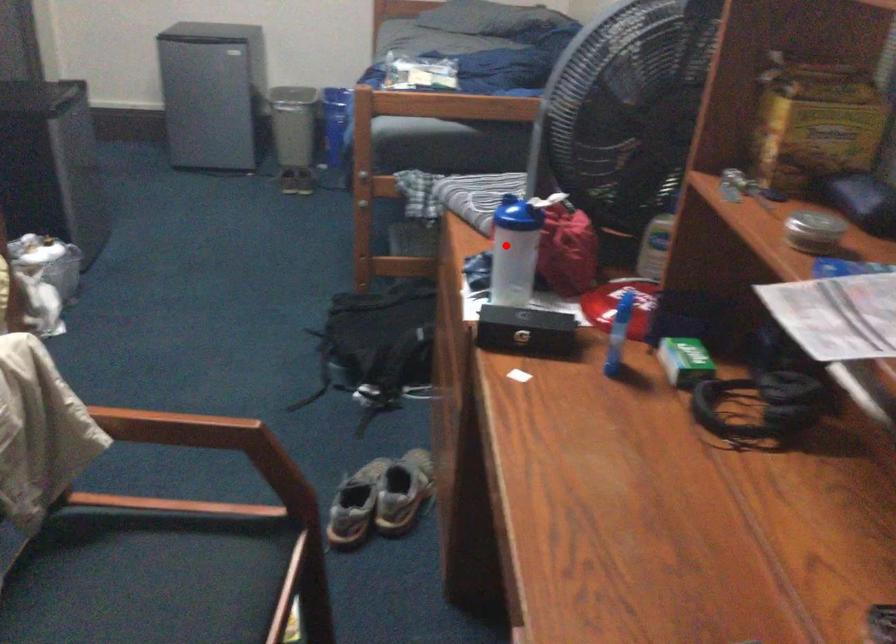
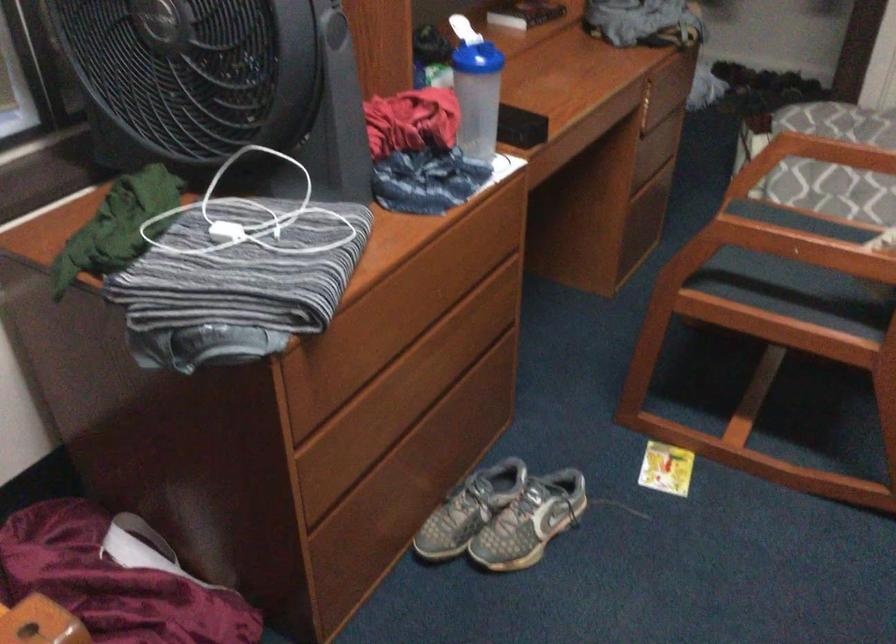
The point at the highlighted location is marked in the first image. Where is the corresponding point in the second image?

(478, 97)